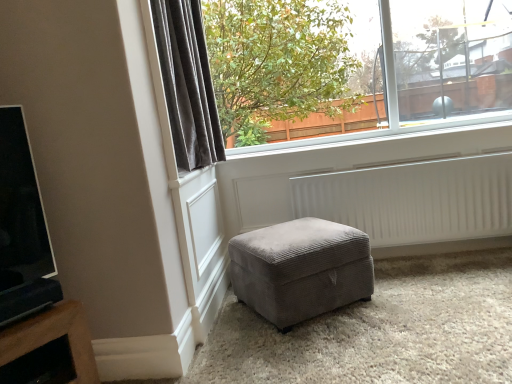
Question: In terms of height, does clear glass window at upper center look taller or shorter compared to velvet gray curtain at upper left?

Choices:
 (A) short
 (B) tall

Answer: (B)

Question: Relative to velvet gray curtain at upper left, is clear glass window at upper center in front or behind?

Choices:
 (A) front
 (B) behind

Answer: (B)

Question: Based on their relative distances, which object is nearer to the clear glass window at upper center?

Choices:
 (A) velvet grey ottoman at center
 (B) velvet gray curtain at upper left
 (C) white ribbed radiator at lower center

Answer: (C)

Question: Which is nearer to the clear glass window at upper center?

Choices:
 (A) velvet grey ottoman at center
 (B) white ribbed radiator at lower center
 (C) velvet gray curtain at upper left

Answer: (B)